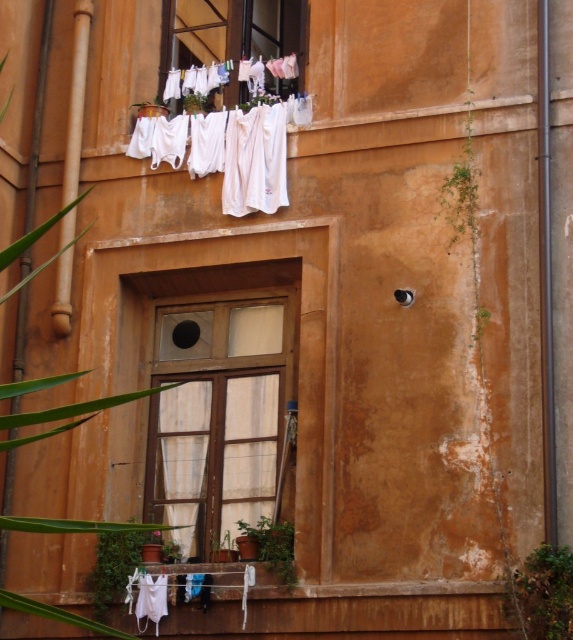
You are standing in front of the building and notice the wooden frame at center and the white sheer curtain at center. Which object is closer to you?

The wooden frame at center is closer to you because the white sheer curtain at center is behind it.

You are standing in front of the building and want to reach both the wooden frame at center and the white fabric at upper center. Which object is closer to you?

The wooden frame at center is closer to you since it is only 13.82 meters away from the white fabric at upper center, but without knowing your exact position, it is difficult to determine the distance from you to each object. However, based on the given information, the wooden frame at center is positioned closer than the white fabric at upper center.